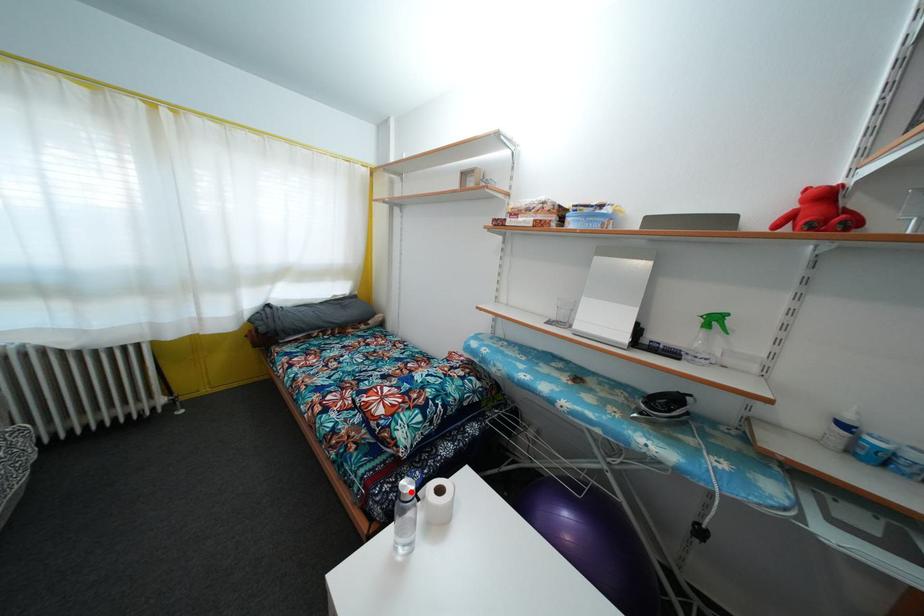
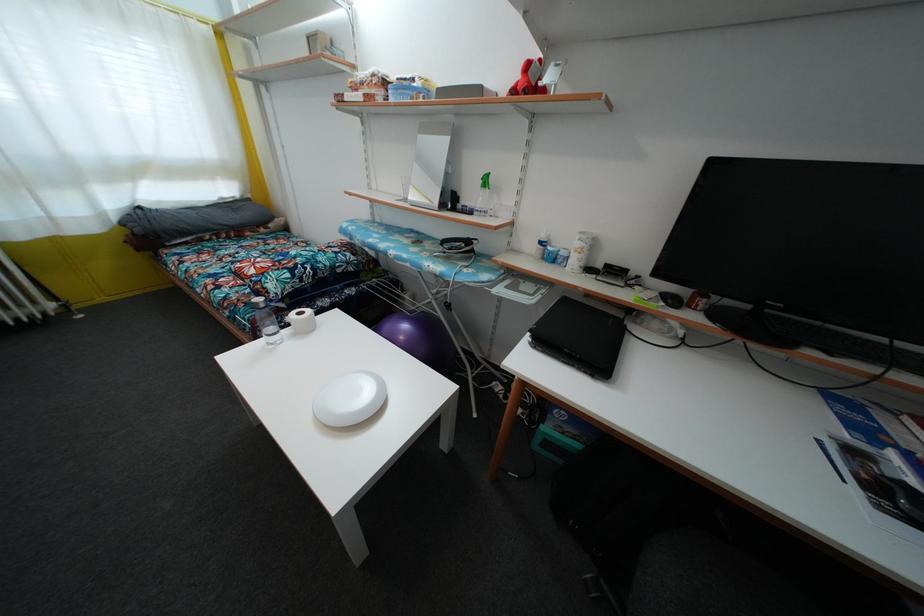
Find the pixel in the second image that matches the highlighted location in the first image.

(263, 307)